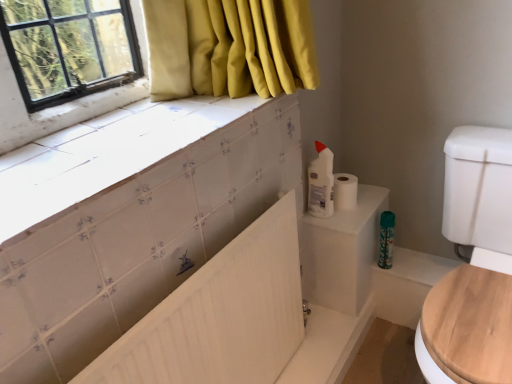
At what (x,y) coordinates should I click in order to perform the action: click on free space on the front side of white matte toilet paper at upper right. Please return your answer as a coordinate pair (x, y). Image resolution: width=512 pixels, height=384 pixels. Looking at the image, I should click on (350, 216).